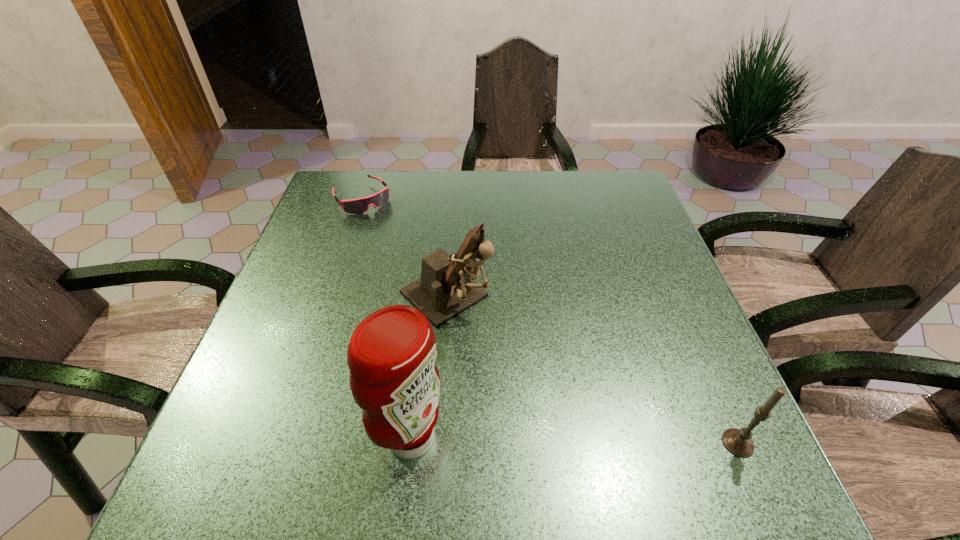
Image resolution: width=960 pixels, height=540 pixels. What are the coordinates of `condiment` in the screenshot? It's located at (391, 355).

Find the location of a particular element. This screenshot has width=960, height=540. candle is located at coordinates (738, 442).

Where is `the third tallest object`? The image size is (960, 540). the third tallest object is located at coordinates (738, 442).

Identify the location of the third nearest object. The image size is (960, 540). (445, 289).

Locate an element on the screen. Image resolution: width=960 pixels, height=540 pixels. the farthest object is located at coordinates (360, 205).

Locate an element on the screen. Image resolution: width=960 pixels, height=540 pixels. the shortest object is located at coordinates (360, 205).

Find the location of `free space located 0.200m on the right of the condiment`. free space located 0.200m on the right of the condiment is located at coordinates (560, 437).

Find the location of a particular element. vacant area situated 0.070m on the back of the rightmost object is located at coordinates pyautogui.click(x=716, y=394).

The width and height of the screenshot is (960, 540). I want to click on free space located 0.190m on the front-facing side of the figurine, so click(x=540, y=386).

At what (x,y) coordinates should I click in order to perform the action: click on vacant space located on the front-facing side of the figurine. Please return your answer as a coordinate pair (x, y). This screenshot has height=540, width=960. Looking at the image, I should click on (590, 432).